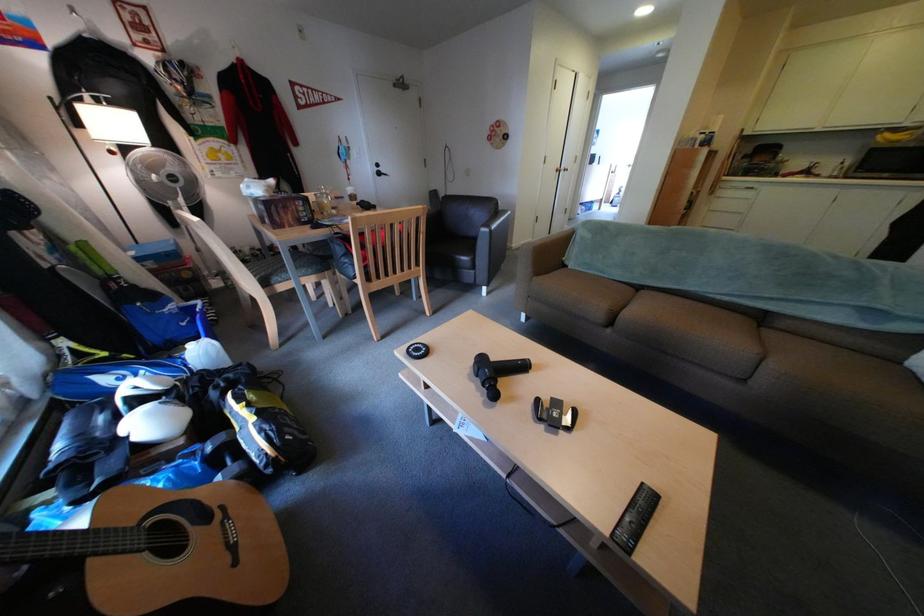
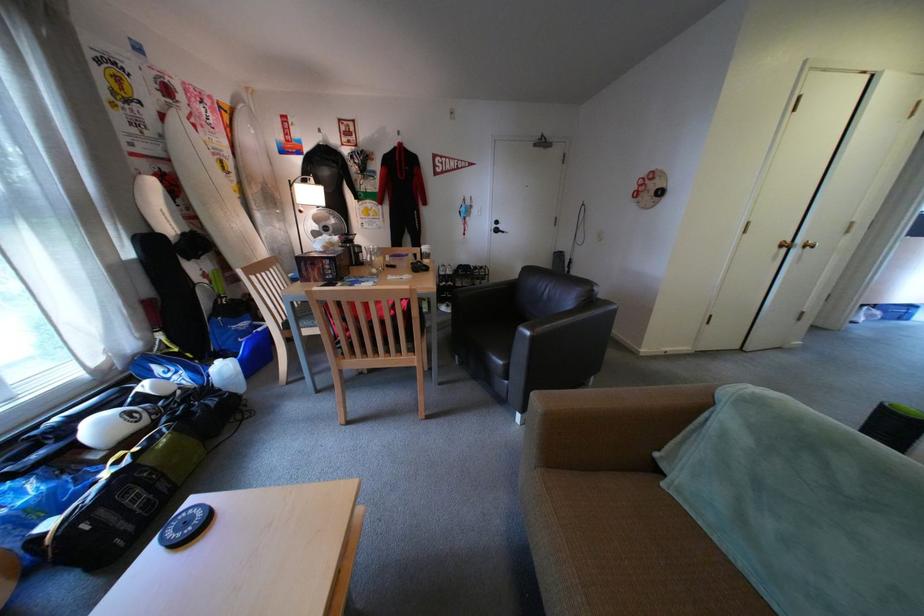
Find the pixel in the second image that matches point 432,351 in the first image.

(199, 525)